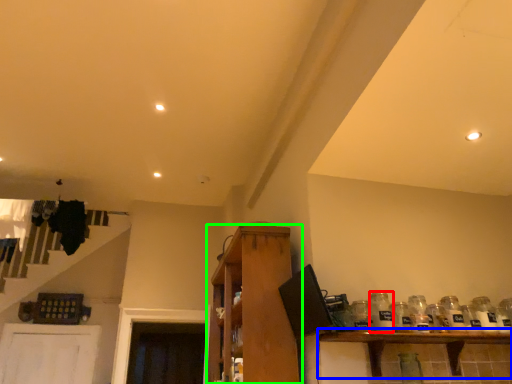
Question: Considering the real-world distances, which object is farthest from glass bottle (highlighted by a red box)? shelf (highlighted by a blue box) or shelf (highlighted by a green box)?

Choices:
 (A) shelf
 (B) shelf

Answer: (B)